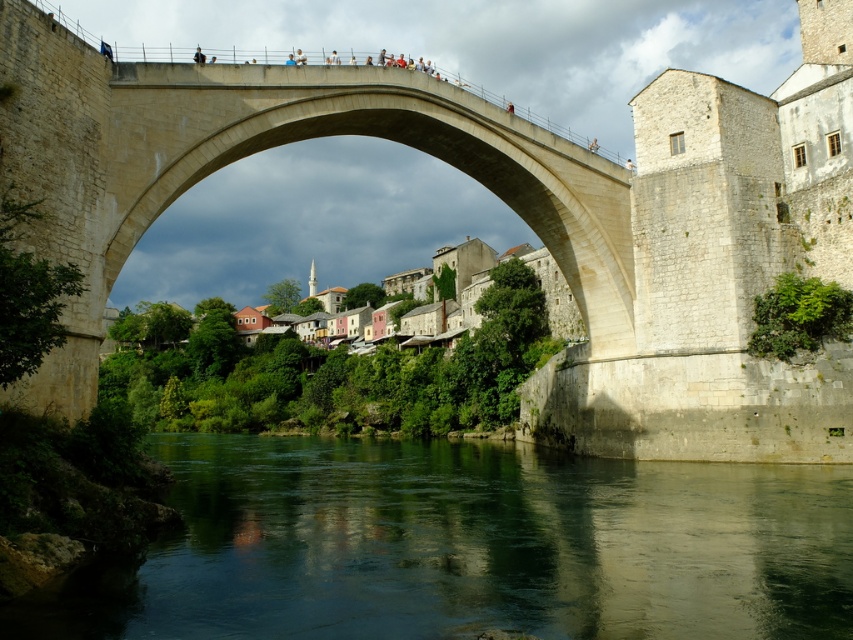
Does green smooth water at lower center have a greater height compared to beige stone bridge at center?

In fact, green smooth water at lower center may be shorter than beige stone bridge at center.

I want to click on green smooth water at lower center, so click(x=467, y=547).